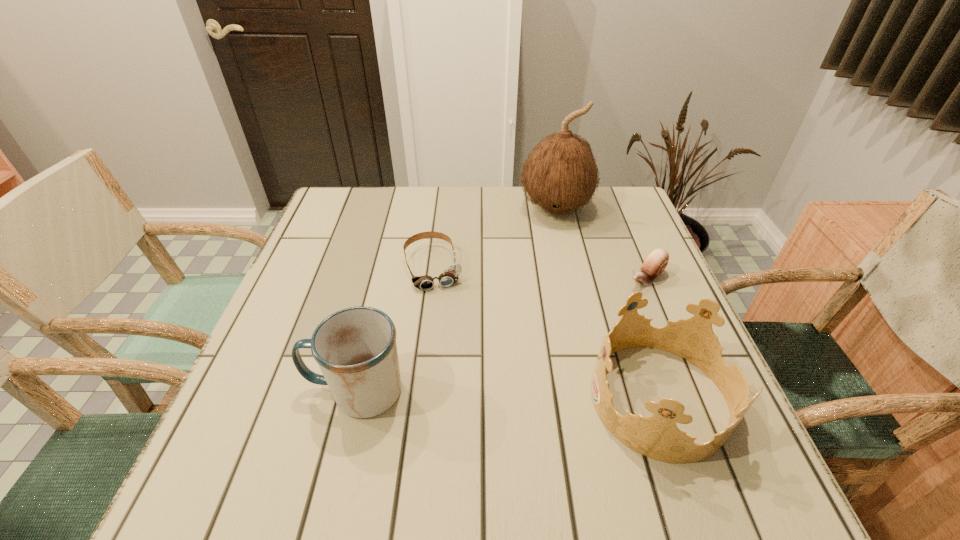
The image size is (960, 540). What are the coordinates of `empty space between the tiara and the coconut` in the screenshot? It's located at (608, 303).

Locate an element on the screen. The width and height of the screenshot is (960, 540). unoccupied position between the coconut and the shortest object is located at coordinates coord(494,238).

Locate an element on the screen. The width and height of the screenshot is (960, 540). vacant area between the tallest object and the fourth tallest object is located at coordinates (x=601, y=244).

Identify the location of free space between the mug and the tiara. (508, 395).

You are a GUI agent. You are given a task and a screenshot of the screen. Output one action in this format:
    pyautogui.click(x=<x>, y=<y>)
    Task: Click on the fourth closest object to the shortest object
    
    Given the screenshot: What is the action you would take?
    pyautogui.click(x=656, y=261)

You are a GUI agent. You are given a task and a screenshot of the screen. Output one action in this format:
    pyautogui.click(x=<x>, y=<y>)
    Task: Click on the object that ranks as the fourth closest to the tiara
    The width and height of the screenshot is (960, 540).
    Given the screenshot: What is the action you would take?
    click(x=560, y=175)